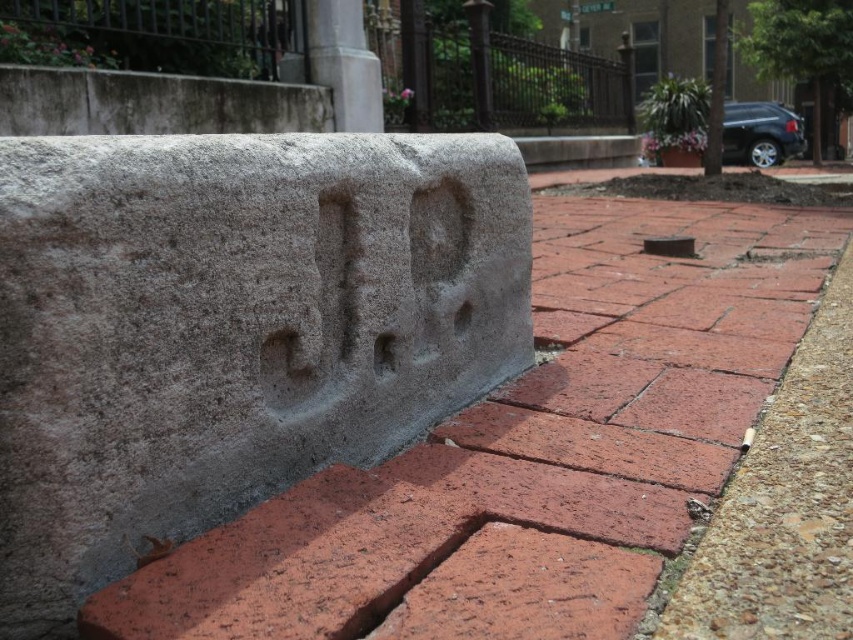
You are a pedestrian walking along the sidewalk and see the gray concrete at center and the red brick pavement at lower right. Which one is located to the left of the other?

The gray concrete at center is to the left of red brick pavement at lower right.

You are a delivery person who needs to place a heavy box on the ground. You see the gray concrete at center and the red brick pavement at lower right. Which surface is more elevated and suitable for placing the box to avoid water pooling during rain?

The gray concrete at center is positioned over the red brick pavement at lower right, meaning it is higher. Therefore, placing the box on the gray concrete at center would be more elevated and suitable to avoid water pooling during rain.